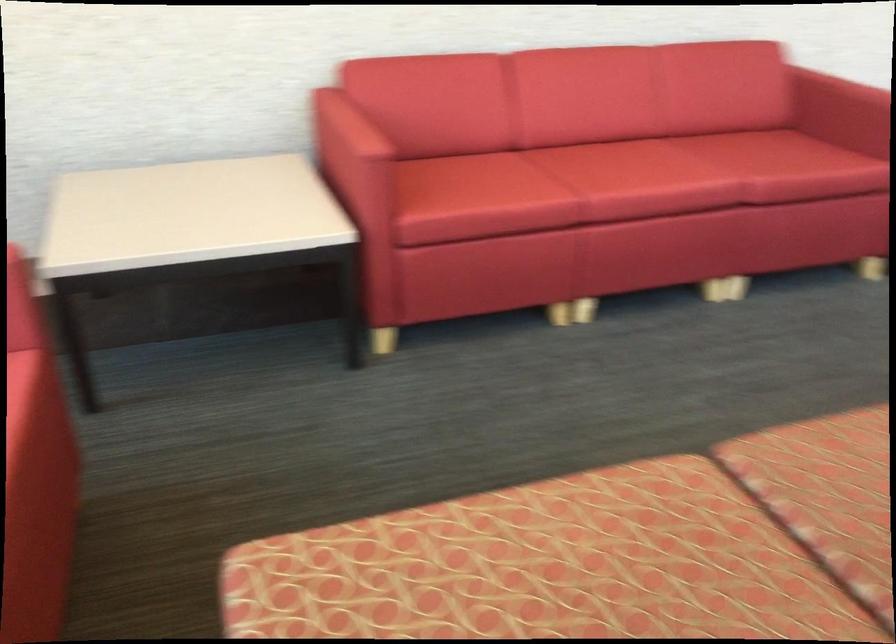
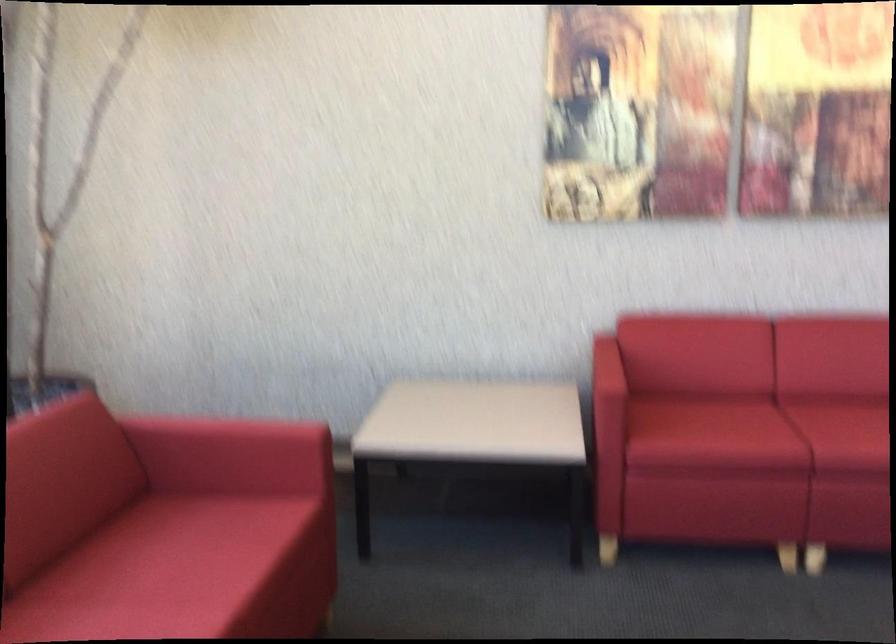
The point at (373, 140) is marked in the first image. Where is the corresponding point in the second image?

(607, 377)